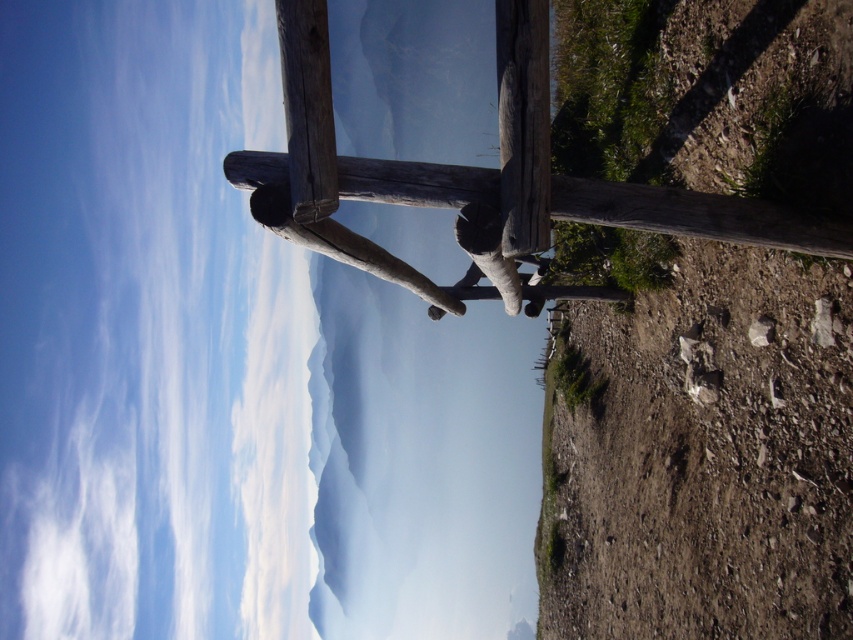
Question: Considering the relative positions of brown rough wood post at right and weathered wood pole at center in the image provided, where is brown rough wood post at right located with respect to weathered wood pole at center?

Choices:
 (A) below
 (B) above

Answer: (A)

Question: Does brown rough wood post at right come in front of weathered wood rail at center?

Choices:
 (A) yes
 (B) no

Answer: (B)

Question: Among these points, which one is nearest to the camera?

Choices:
 (A) (732, 240)
 (B) (287, 90)
 (C) (577, 240)

Answer: (B)

Question: Does brown rough wood post at right appear on the right side of weathered wood rail at center?

Choices:
 (A) yes
 (B) no

Answer: (A)

Question: Among these objects, which one is nearest to the camera?

Choices:
 (A) weathered wood rail at center
 (B) weathered wood pole at center
 (C) brown rough wood post at right

Answer: (B)

Question: Which of the following is the farthest from the observer?

Choices:
 (A) weathered wood pole at center
 (B) weathered wood rail at center

Answer: (B)